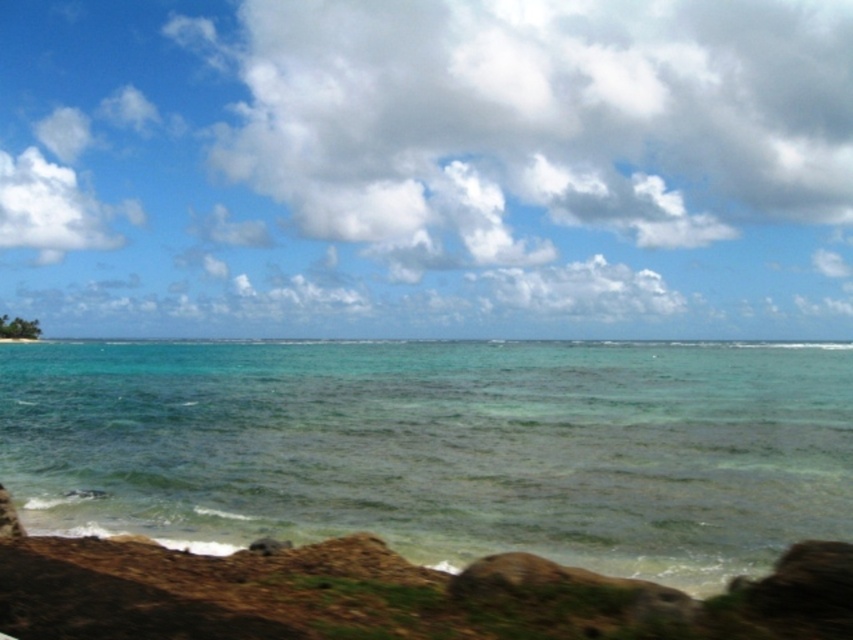
Question: Does clear water at center appear on the right side of white fluffy cloud at upper left?

Choices:
 (A) yes
 (B) no

Answer: (A)

Question: Which is nearer to the white fluffy cloud at upper center?

Choices:
 (A) white fluffy cloud at upper left
 (B) clear water at center

Answer: (A)

Question: Which is farther from the white fluffy cloud at upper center?

Choices:
 (A) white fluffy cloud at upper left
 (B) clear water at center

Answer: (B)

Question: Considering the relative positions of clear water at center and white fluffy cloud at upper left in the image provided, where is clear water at center located with respect to white fluffy cloud at upper left?

Choices:
 (A) left
 (B) right

Answer: (B)

Question: Is white fluffy cloud at upper center bigger than white fluffy cloud at upper left?

Choices:
 (A) no
 (B) yes

Answer: (B)

Question: Which point is closer to the camera taking this photo?

Choices:
 (A) (49, 193)
 (B) (817, 131)

Answer: (A)